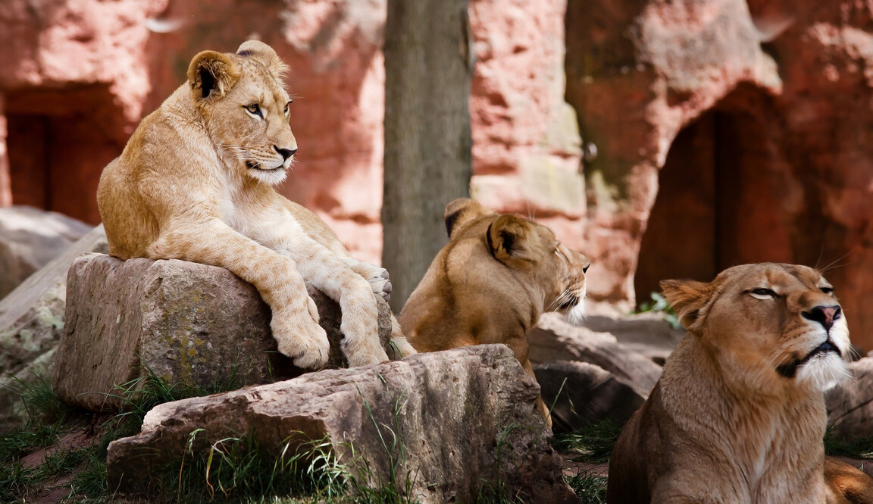
I want to click on door, so click(x=30, y=179).